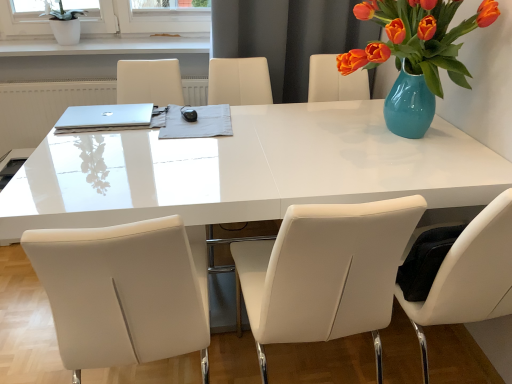
Locate an element on the screen. This screenshot has width=512, height=384. blank space to the left of gray fabric at center is located at coordinates (116, 134).